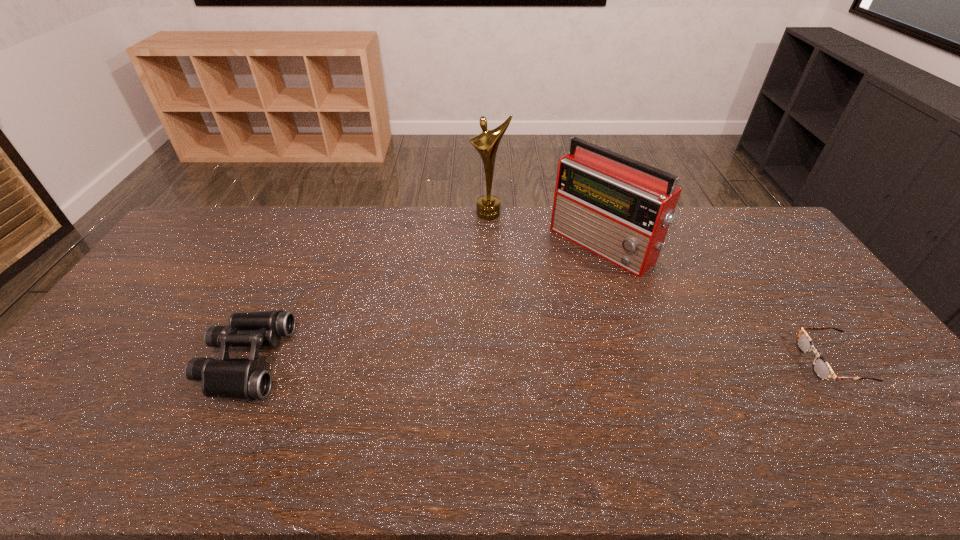
Locate an element on the screen. The height and width of the screenshot is (540, 960). free spot on the desktop that is between the leftmost object and the shortest object and is positioned on the front-facing side of the third object from left to right is located at coordinates pos(456,361).

You are a GUI agent. You are given a task and a screenshot of the screen. Output one action in this format:
    pyautogui.click(x=<x>, y=<y>)
    Task: Click on the vacant space on the desktop that is between the leftmost object and the spectacles and is positioned on the front-facing side of the award
    
    Given the screenshot: What is the action you would take?
    pyautogui.click(x=499, y=361)